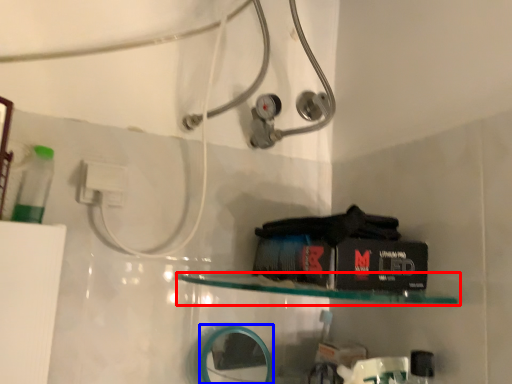
Question: Which object appears closest to the camera in this image, shelf (highlighted by a red box) or mirror (highlighted by a blue box)?

Choices:
 (A) shelf
 (B) mirror

Answer: (A)